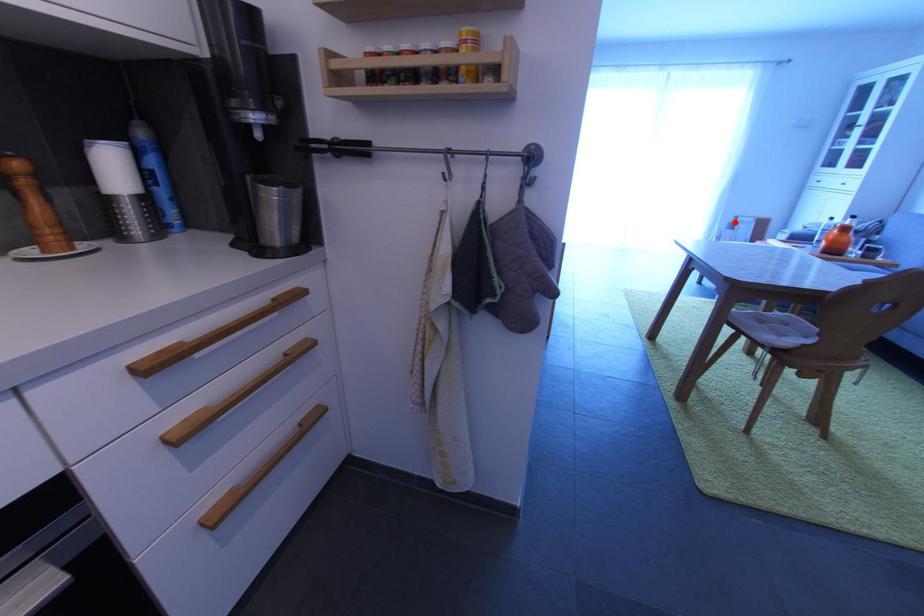
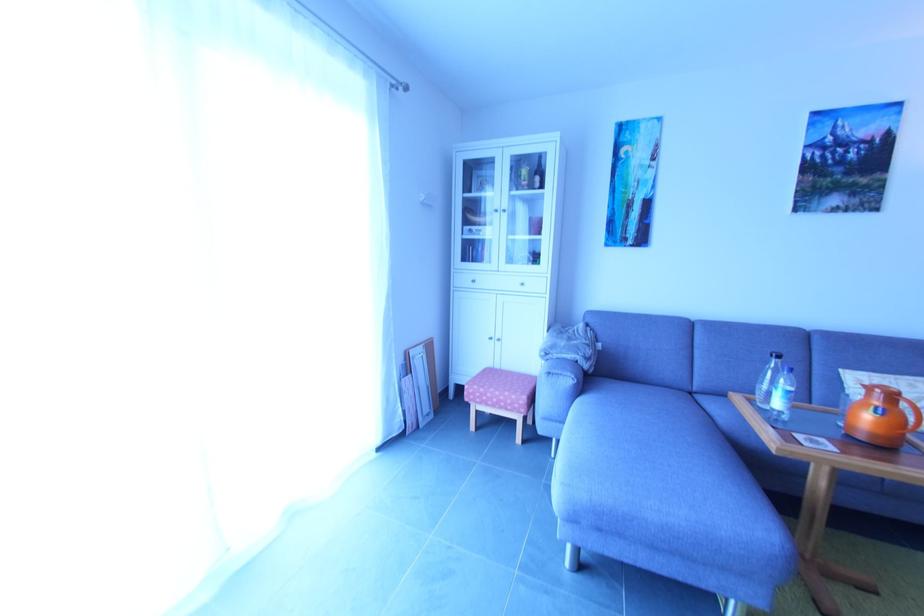
Question: I am providing you with two images of the same scene from different viewpoints. Given a red point in image1, look at the same physical point in image2. Is it:

Choices:
 (A) Closer to the viewpoint
 (B) Farther from the viewpoint

Answer: (B)